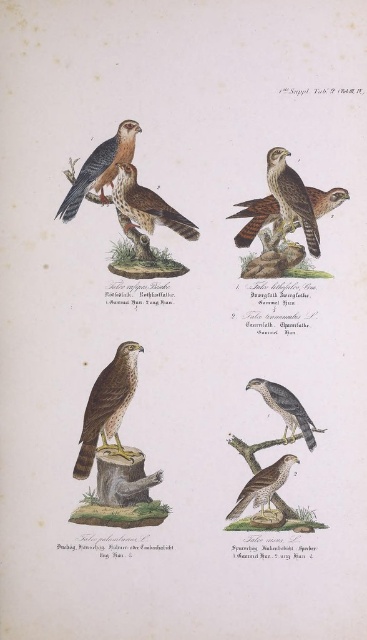
Does point (103, 372) lie in front of point (102, 157)?

No, (103, 372) is further to viewer.

Who is more distant from viewer, (102,445) or (114,141)?

The point (102,445) is behind.

Identify the location of brown speckled falcon at center. (107, 406).

Is point (339, 188) positioned in front of point (274, 406)?

Yes, point (339, 188) is closer to viewer.

Does point (280, 221) lie behind point (292, 406)?

Yes, point (280, 221) is farther from viewer.

Where is `rufous-brown feathered falcon at center`? The width and height of the screenshot is (367, 640). rufous-brown feathered falcon at center is located at coordinates (256, 218).

Can you confirm if brown speckled feathers at center is smaller than rufous-brown feathered falcon at center?

Indeed, brown speckled feathers at center has a smaller size compared to rufous-brown feathered falcon at center.

Is point (139, 209) less distant than point (273, 236)?

Yes, point (139, 209) is in front of point (273, 236).

Find the location of a particular element. brown speckled feathers at center is located at coordinates (147, 205).